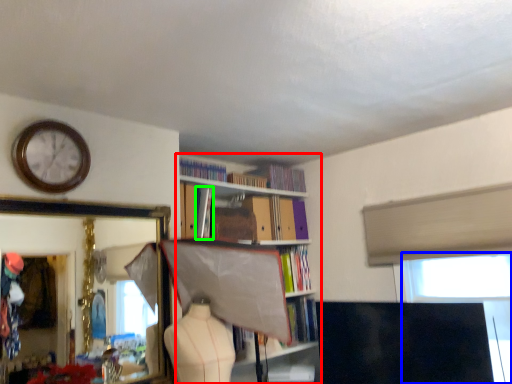
Question: Which is farther away from bookcase (highlighted by a red box)? window screen (highlighted by a blue box) or book (highlighted by a green box)?

Choices:
 (A) window screen
 (B) book

Answer: (A)